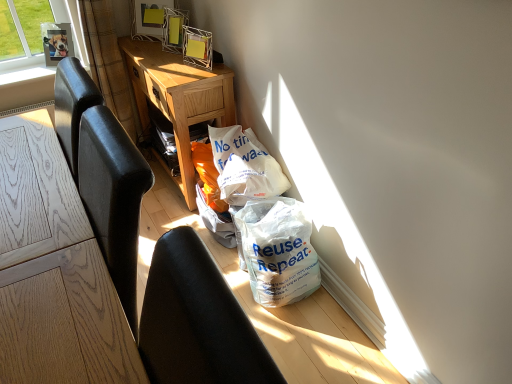
Where is `vacant space situated above light wood table at left (from a real-world perspective)`? vacant space situated above light wood table at left (from a real-world perspective) is located at coordinates (29, 236).